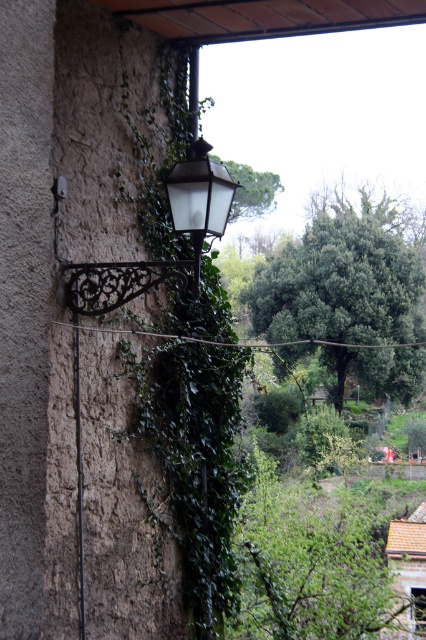
Question: Which of the following is the closest to the observer?

Choices:
 (A) green leafy tree at center
 (B) green leafy tree at upper center
 (C) white frosted glass lantern at upper center

Answer: (C)

Question: Which object appears farthest from the camera in this image?

Choices:
 (A) green leafy tree at upper center
 (B) white frosted glass lantern at upper center

Answer: (A)

Question: Can you confirm if white frosted glass lantern at upper center is bigger than green leafy tree at upper center?

Choices:
 (A) yes
 (B) no

Answer: (B)

Question: Which of these objects is positioned farthest from the green leafy tree at upper center?

Choices:
 (A) green leafy tree at center
 (B) white frosted glass lantern at upper center

Answer: (B)

Question: Is green leafy tree at center to the left of white frosted glass lantern at upper center from the viewer's perspective?

Choices:
 (A) no
 (B) yes

Answer: (A)

Question: Is green leafy tree at center closer to camera compared to green leafy tree at upper center?

Choices:
 (A) yes
 (B) no

Answer: (B)